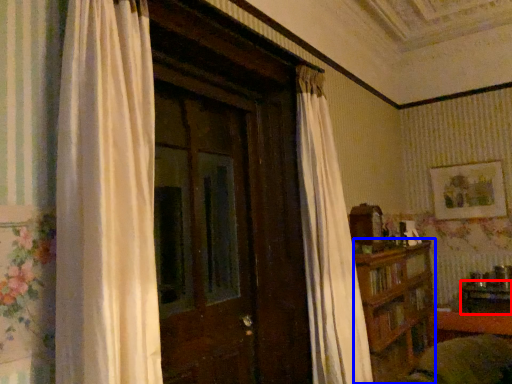
Question: Which point is further to the camera, table (highlighted by a red box) or furniture (highlighted by a blue box)?

Choices:
 (A) table
 (B) furniture

Answer: (A)